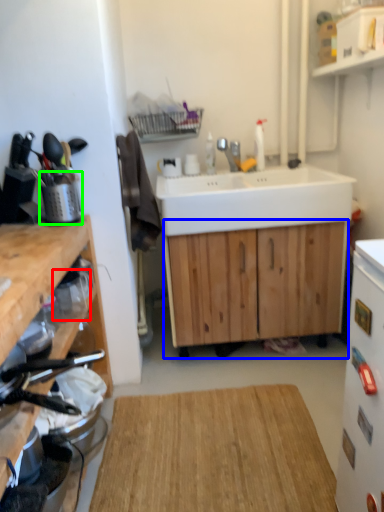
Question: Which object is the closest to the appliance (highlighted by a red box)? Choose among these: cabinetry (highlighted by a blue box) or appliance (highlighted by a green box).

Choices:
 (A) cabinetry
 (B) appliance

Answer: (B)